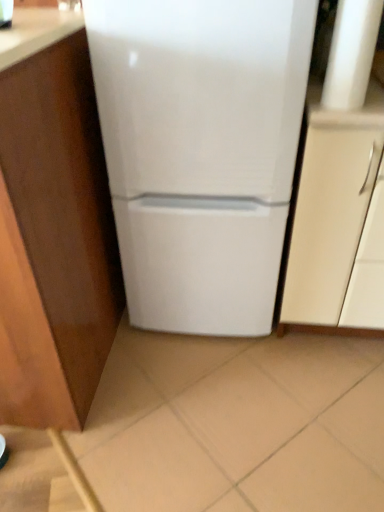
Question: Considering the positions of point (294, 73) and point (349, 247), is point (294, 73) closer or farther from the camera than point (349, 247)?

Choices:
 (A) farther
 (B) closer

Answer: (B)

Question: Looking at their shapes, would you say white glossy refrigerator at center is wider or thinner than matte white cabinet at right, positioned as the first cabinetry in right-to-left order?

Choices:
 (A) thin
 (B) wide

Answer: (A)

Question: Considering the real-world distances, which object is farthest from the matte white cabinet at right, which appears as the 2th cabinetry when viewed from the left?

Choices:
 (A) white glossy refrigerator at center
 (B) wooden cabinet at left, the first cabinetry viewed from the left

Answer: (B)

Question: Estimate the real-world distances between objects in this image. Which object is closer to the matte white cabinet at right, positioned as the first cabinetry in right-to-left order?

Choices:
 (A) wooden cabinet at left, the first cabinetry viewed from the left
 (B) white glossy refrigerator at center

Answer: (B)